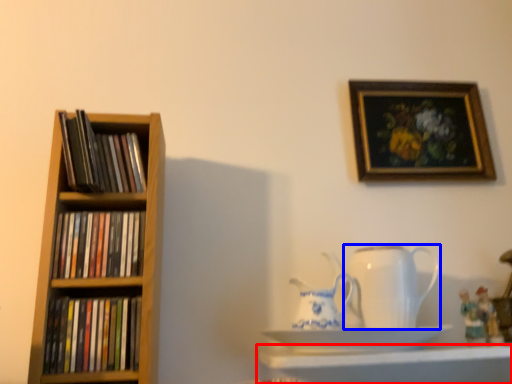
Question: Which object is closer to the camera taking this photo, shelf (highlighted by a red box) or jug (highlighted by a blue box)?

Choices:
 (A) shelf
 (B) jug

Answer: (A)